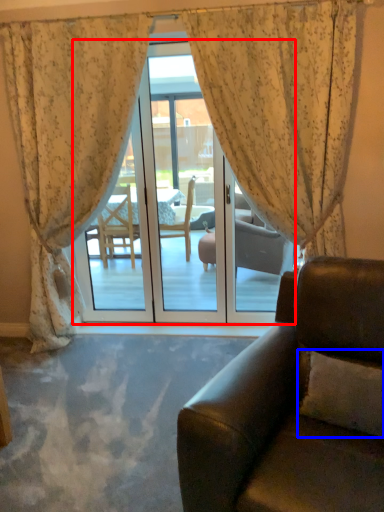
Question: Which object is further to the camera taking this photo, door (highlighted by a red box) or pillow (highlighted by a blue box)?

Choices:
 (A) door
 (B) pillow

Answer: (A)